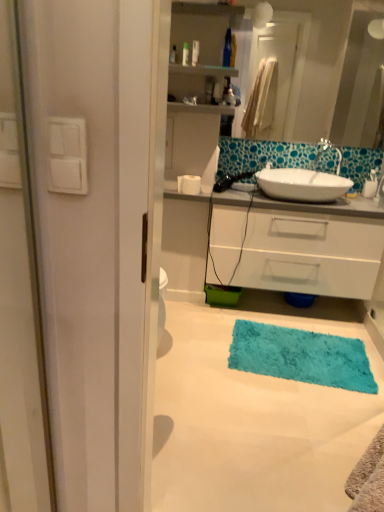
The height and width of the screenshot is (512, 384). In order to click on vacant point above turquoise shaggy rug at lower center (from a real-world perspective) in this screenshot , I will do `click(251, 382)`.